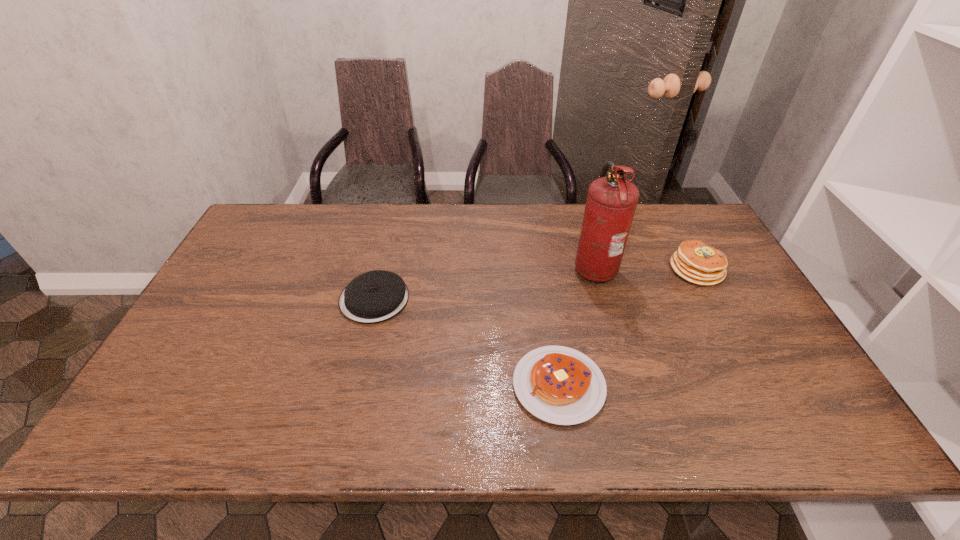
This screenshot has width=960, height=540. What are the coordinates of `fire extinguisher` in the screenshot? It's located at 611,202.

Image resolution: width=960 pixels, height=540 pixels. I want to click on the rightmost pancake, so click(694, 261).

I want to click on the tallest pancake, so click(x=694, y=261).

Locate an element on the screen. The height and width of the screenshot is (540, 960). the second shortest pancake is located at coordinates (x=376, y=296).

Find the location of a particular element. the second shortest object is located at coordinates (376, 296).

Find the location of a particular element. The width and height of the screenshot is (960, 540). the shortest object is located at coordinates (560, 385).

Locate an element on the screen. The height and width of the screenshot is (540, 960). the nearest pancake is located at coordinates (560, 385).

I want to click on vacant space located at the front of the fire extinguisher where the nozzle is aimed, so click(x=456, y=266).

This screenshot has width=960, height=540. I want to click on vacant position located 0.090m at the front of the fire extinguisher where the nozzle is aimed, so click(x=543, y=266).

What are the coordinates of `vacant space positioned at the front of the fire extinguisher where the nozzle is aimed` in the screenshot? It's located at (508, 266).